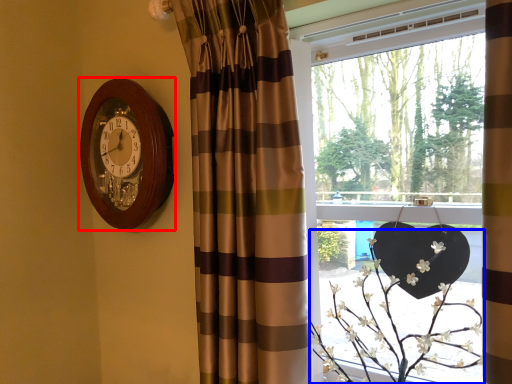
Question: Which point is closer to the camera, wall clock (highlighted by a red box) or floral arrangement (highlighted by a blue box)?

Choices:
 (A) wall clock
 (B) floral arrangement

Answer: (B)